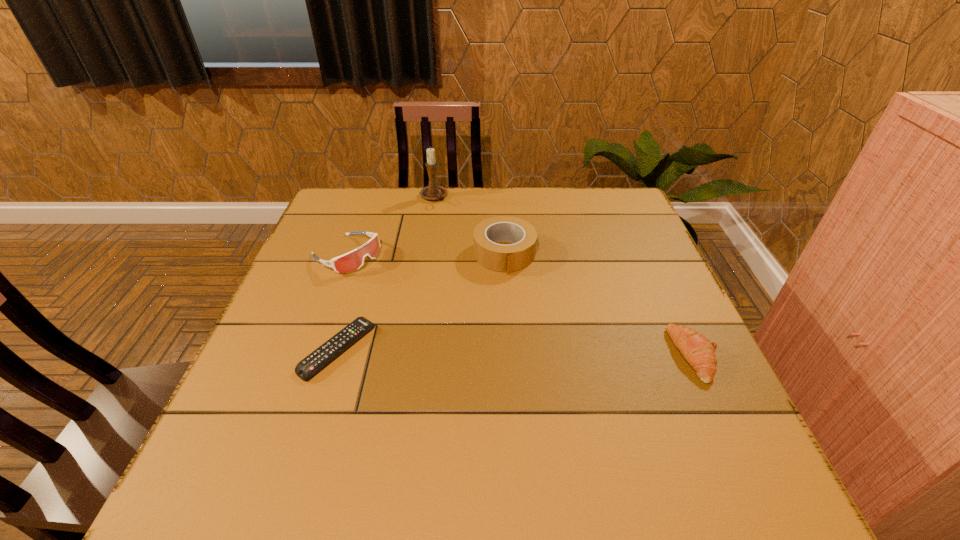
What are the coordinates of `free space between the fourth object from left to right and the fourth tallest object` in the screenshot? It's located at (599, 305).

You are a GUI agent. You are given a task and a screenshot of the screen. Output one action in this format:
    pyautogui.click(x=<x>, y=<y>)
    Task: Click on the vacant space that's between the remote control and the rightmost object
    This screenshot has height=540, width=960.
    Given the screenshot: What is the action you would take?
    pyautogui.click(x=516, y=352)

I want to click on free point between the crescent roll and the shortest object, so click(516, 352).

The width and height of the screenshot is (960, 540). Identify the location of vacant area that lies between the shortest object and the duct tape. click(x=421, y=301).

Find the location of `unoccupied position between the farthest object and the crescent roll`. unoccupied position between the farthest object and the crescent roll is located at coordinates (564, 276).

This screenshot has width=960, height=540. I want to click on empty location between the second object from right to left and the third object from right to left, so click(468, 226).

Find the location of a particular element. The height and width of the screenshot is (540, 960). free area in between the third object from left to right and the rightmost object is located at coordinates (564, 276).

I want to click on object that is the closest to the remote control, so click(x=353, y=260).

The width and height of the screenshot is (960, 540). I want to click on object that stands as the third closest to the crescent roll, so click(353, 260).

Where is `free space in the image that satisfies the following two spatial constraints: 1. on the back side of the duct tape; 2. on the right side of the goggles`? free space in the image that satisfies the following two spatial constraints: 1. on the back side of the duct tape; 2. on the right side of the goggles is located at coordinates (347, 254).